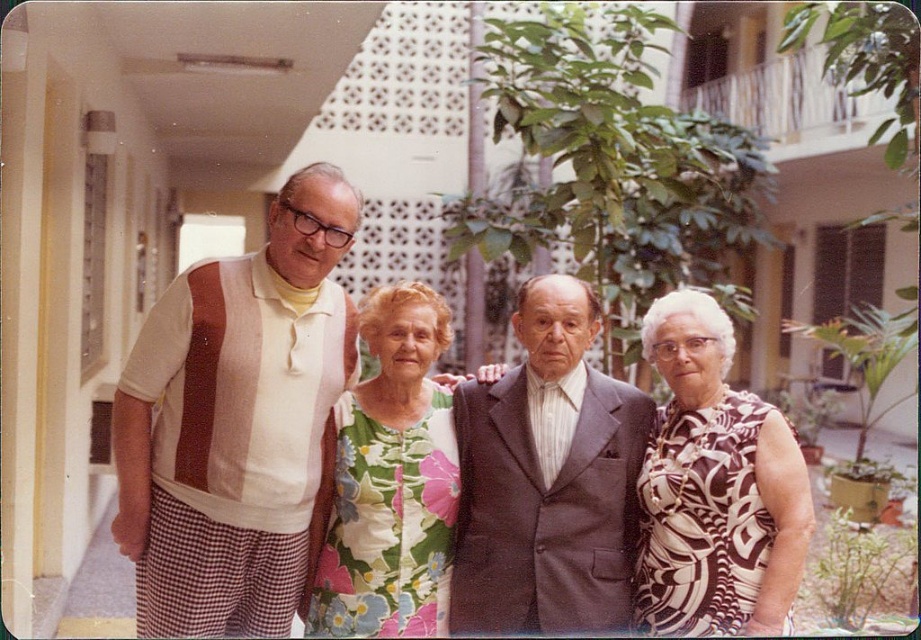
Question: Estimate the real-world distances between objects in this image. Which object is farther from the floral fabric blouse at center?

Choices:
 (A) striped cotton shirt at center
 (B) floral fabric dress at center
 (C) black and white patterned dress at right
 (D) dark gray suit at center

Answer: (C)

Question: Is striped cotton shirt at center above black and white patterned dress at right?

Choices:
 (A) yes
 (B) no

Answer: (A)

Question: Which point is farther to the camera?

Choices:
 (A) (704, 548)
 (B) (433, 515)
 (C) (188, 324)

Answer: (B)

Question: Is floral fabric blouse at center thinner than dark gray suit at center?

Choices:
 (A) yes
 (B) no

Answer: (B)

Question: Which object is positioned closest to the black and white patterned dress at right?

Choices:
 (A) striped cotton shirt at center
 (B) floral fabric dress at center
 (C) floral fabric blouse at center

Answer: (B)

Question: Does black and white patterned dress at right appear over floral fabric dress at center?

Choices:
 (A) yes
 (B) no

Answer: (A)